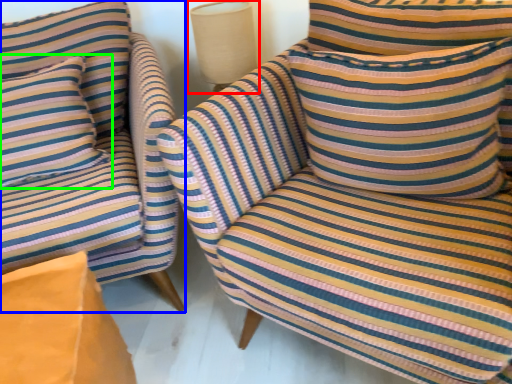
Question: Based on their relative distances, which object is nearer to table lamp (highlighted by a red box)? Choose from chair (highlighted by a blue box) and pillow (highlighted by a green box).

Choices:
 (A) chair
 (B) pillow

Answer: (A)